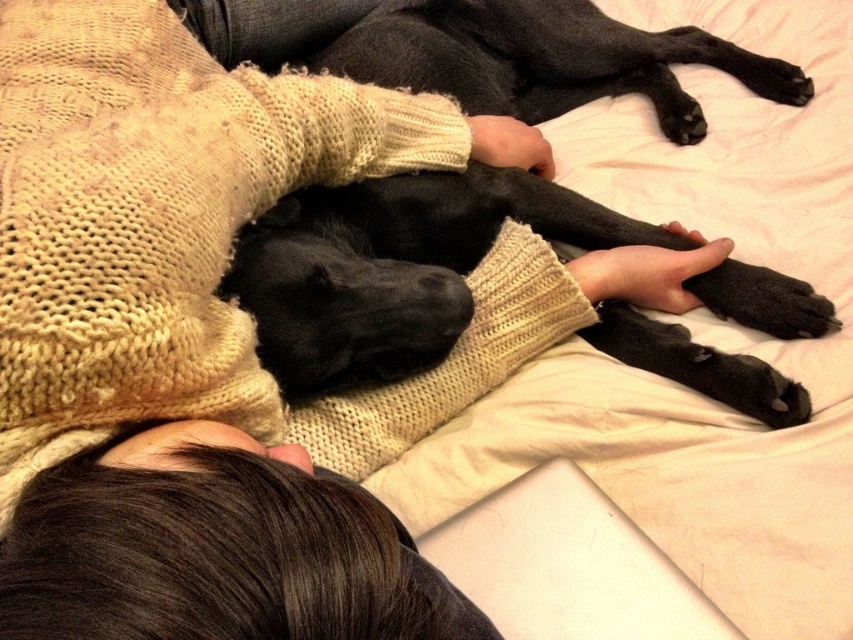
Who is shorter, black smooth dog at center or brown knitted sweater at upper center?

Standing shorter between the two is brown knitted sweater at upper center.

Is black smooth dog at center to the left of brown knitted sweater at upper center from the viewer's perspective?

In fact, black smooth dog at center is to the right of brown knitted sweater at upper center.

Is point (492, 76) closer to camera compared to point (370, 502)?

That is False.

Image resolution: width=853 pixels, height=640 pixels. Identify the location of black smooth dog at center. (393, 268).